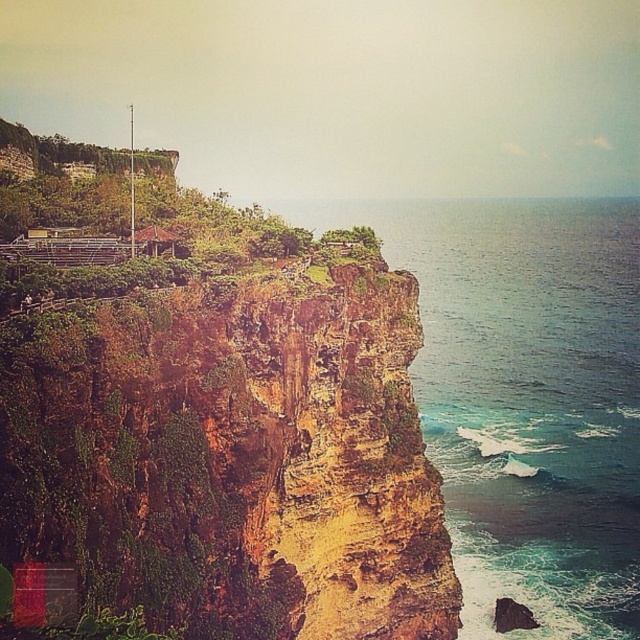
Question: Does rusty rock cliff at left appear over greenish-blue water at cliff edge?

Choices:
 (A) no
 (B) yes

Answer: (A)

Question: Is rusty rock cliff at left closer to camera compared to greenish-blue water at cliff edge?

Choices:
 (A) no
 (B) yes

Answer: (B)

Question: Which object is farther from the camera taking this photo?

Choices:
 (A) greenish-blue water at cliff edge
 (B) rusty rock cliff at left

Answer: (A)

Question: Is rusty rock cliff at left smaller than greenish-blue water at cliff edge?

Choices:
 (A) no
 (B) yes

Answer: (B)

Question: Which of the following is the farthest from the observer?

Choices:
 (A) [486, 609]
 (B) [163, 499]

Answer: (A)